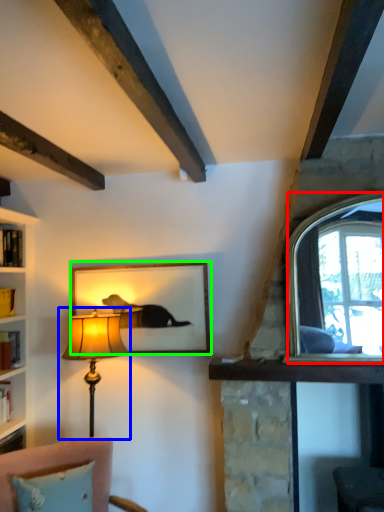
Question: Which is farther away from window (highlighted by a red box)? lamp (highlighted by a blue box) or picture frame (highlighted by a green box)?

Choices:
 (A) lamp
 (B) picture frame

Answer: (A)